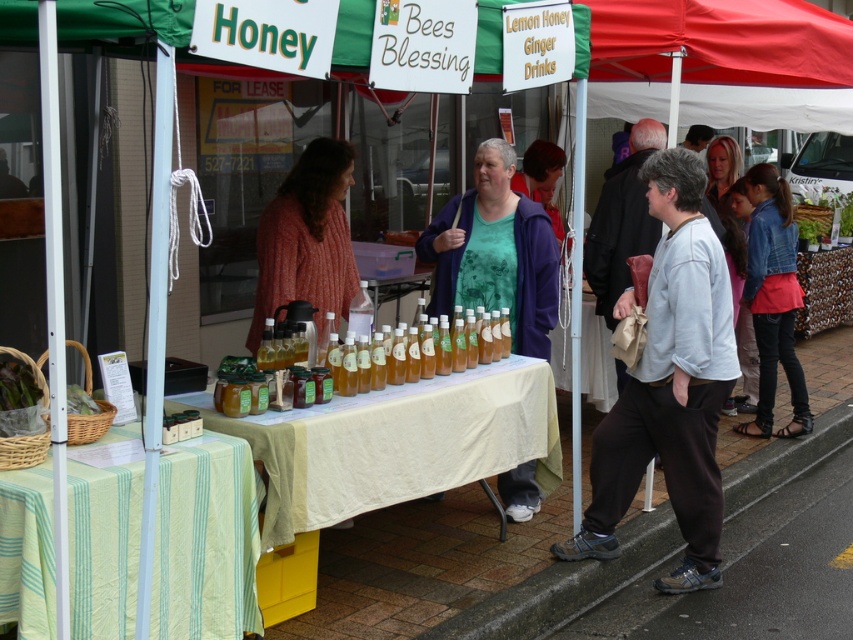
You are standing at the market stall and want to locate two specific points on the table. The first point is at coordinates point (24, 492) and the second is at point (724, 212). Which point is closer to you as you face the table?

Point (24, 492) is in front of point (724, 212), so it is closer to you when facing the table.